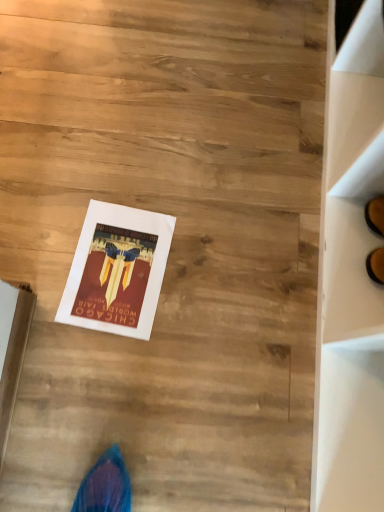
The image size is (384, 512). I want to click on free space underneath matte paper poster at center (from a real-world perspective), so click(x=112, y=268).